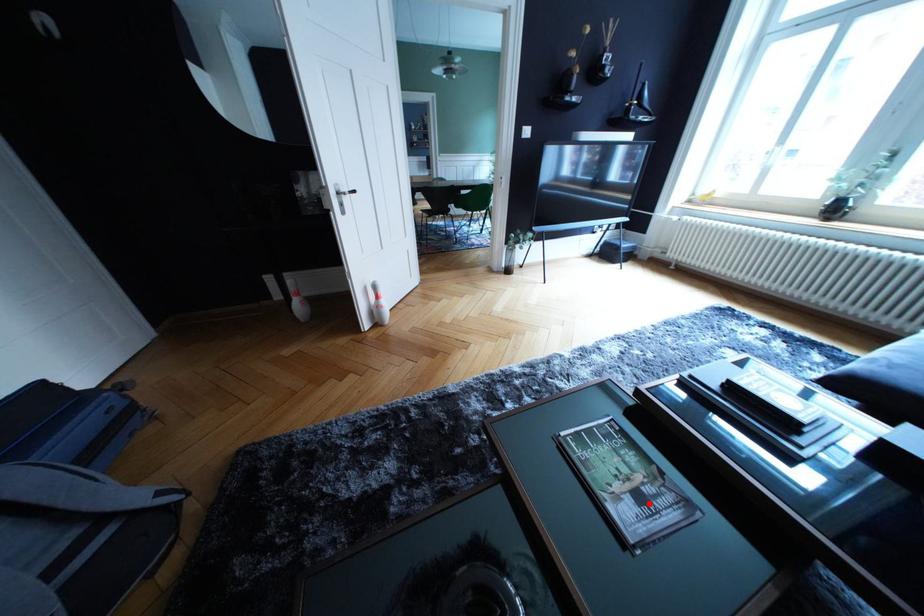
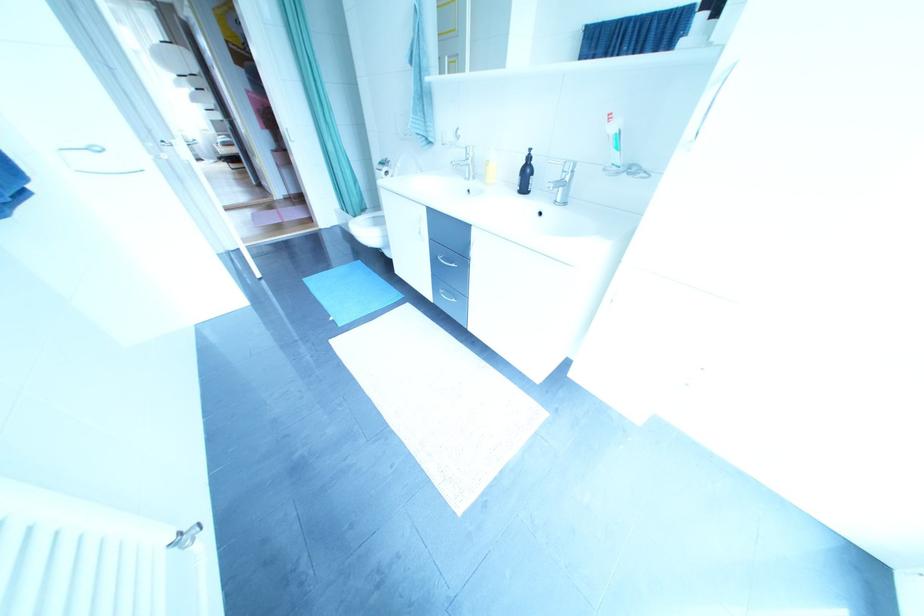
Question: I am providing you with two images of the same scene from different viewpoints. A red point is marked on the first image. Is the red point's position out of view in image 2?

Choices:
 (A) Yes
 (B) No

Answer: (A)